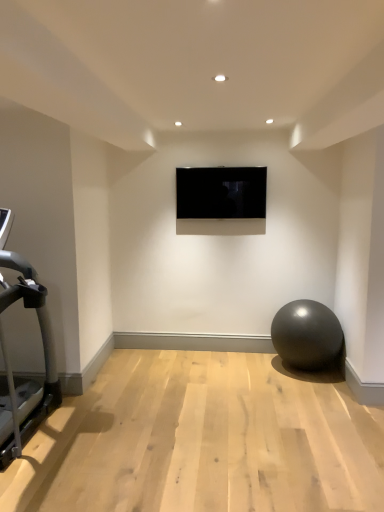
Question: Is the depth of glossy rubber ball at lower right greater than that of silver metallic treadmill at left?

Choices:
 (A) yes
 (B) no

Answer: (A)

Question: Does glossy rubber ball at lower right turn towards silver metallic treadmill at left?

Choices:
 (A) no
 (B) yes

Answer: (A)

Question: Does glossy rubber ball at lower right appear on the left side of silver metallic treadmill at left?

Choices:
 (A) yes
 (B) no

Answer: (B)

Question: From a real-world perspective, is glossy rubber ball at lower right below silver metallic treadmill at left?

Choices:
 (A) yes
 (B) no

Answer: (A)

Question: Can you confirm if glossy rubber ball at lower right is shorter than silver metallic treadmill at left?

Choices:
 (A) yes
 (B) no

Answer: (A)

Question: Can you confirm if glossy rubber ball at lower right is smaller than silver metallic treadmill at left?

Choices:
 (A) no
 (B) yes

Answer: (B)

Question: Can you confirm if glossy rubber ball at lower right is taller than black glossy tv at center?

Choices:
 (A) yes
 (B) no

Answer: (A)

Question: From the image's perspective, does glossy rubber ball at lower right appear lower than black glossy tv at center?

Choices:
 (A) yes
 (B) no

Answer: (A)

Question: Is glossy rubber ball at lower right at the left side of black glossy tv at center?

Choices:
 (A) no
 (B) yes

Answer: (A)

Question: Are glossy rubber ball at lower right and black glossy tv at center making contact?

Choices:
 (A) yes
 (B) no

Answer: (B)

Question: From the image's perspective, does glossy rubber ball at lower right appear higher than black glossy tv at center?

Choices:
 (A) yes
 (B) no

Answer: (B)

Question: Is glossy rubber ball at lower right shorter than black glossy tv at center?

Choices:
 (A) yes
 (B) no

Answer: (B)

Question: Is black glossy tv at center with glossy rubber ball at lower right?

Choices:
 (A) yes
 (B) no

Answer: (B)